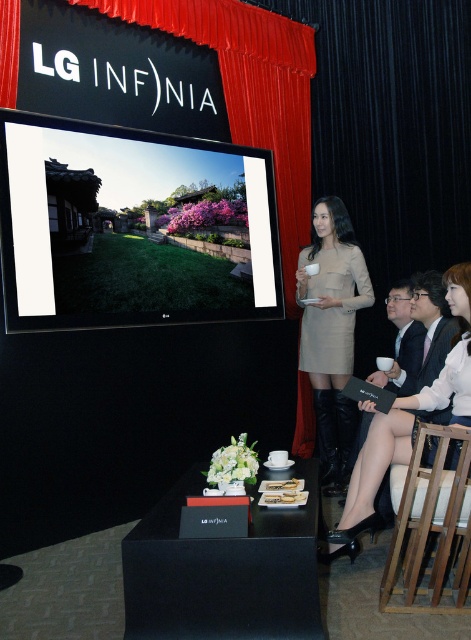
Question: Which object is positioned closest to the matte black screen at upper left?

Choices:
 (A) wooden at right
 (B) red velvet curtain at upper center
 (C) beige fabric dress at center

Answer: (C)

Question: Estimate the real-world distances between objects in this image. Which object is farther from the beige fabric dress at center?

Choices:
 (A) wooden at right
 (B) light beige dress at center
 (C) matte black screen at upper left
 (D) red velvet curtain at upper center

Answer: (A)

Question: Which point is closer to the camera taking this photo?

Choices:
 (A) (357, 259)
 (B) (455, 534)
 (C) (400, 458)

Answer: (B)

Question: Does beige fabric dress at center have a larger size compared to light beige dress at center?

Choices:
 (A) yes
 (B) no

Answer: (B)

Question: Is wooden at right to the right of light beige dress at center from the viewer's perspective?

Choices:
 (A) yes
 (B) no

Answer: (B)

Question: Does red velvet curtain at upper center come behind wooden at right?

Choices:
 (A) yes
 (B) no

Answer: (A)